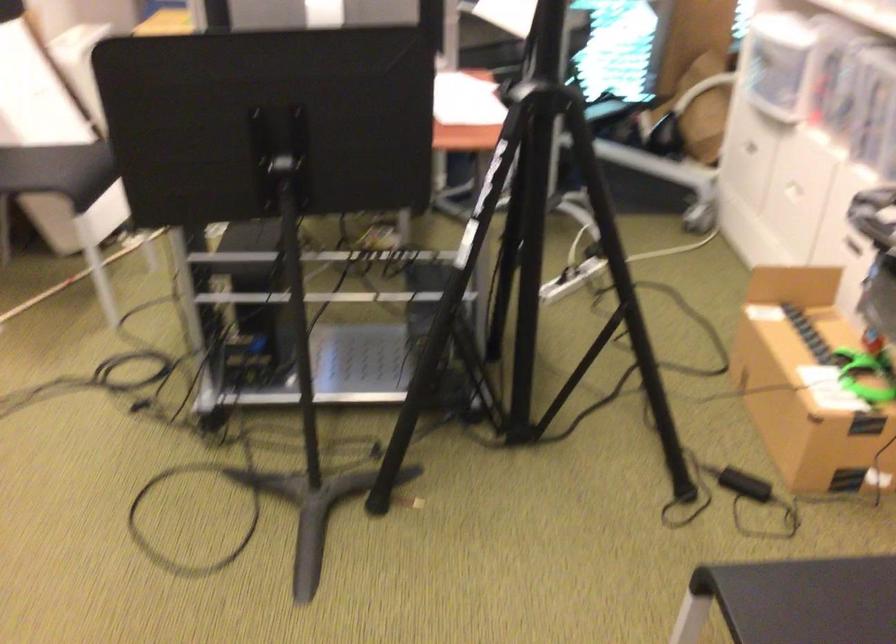
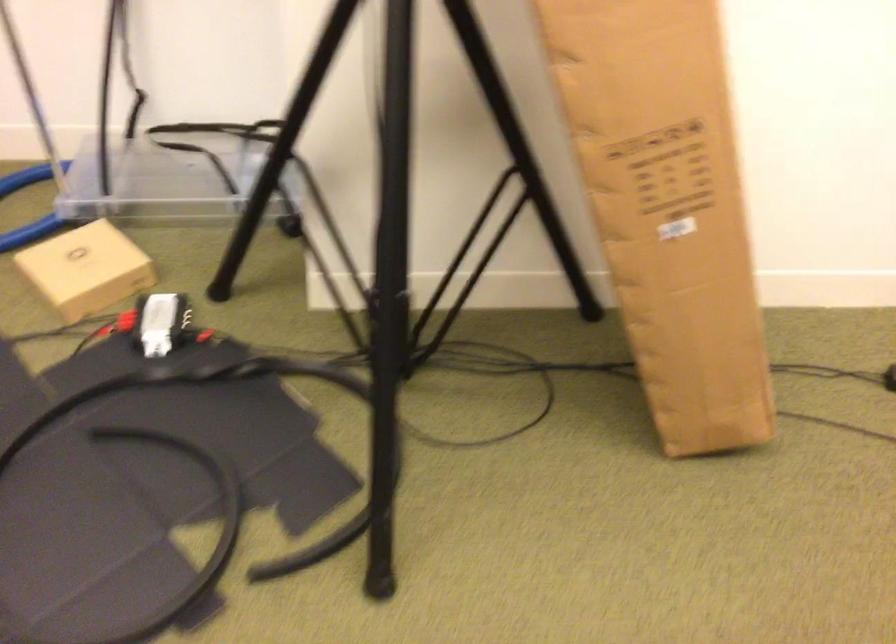
First-person continuous shooting, in which direction is the camera rotating?

The camera rotated toward left-down.